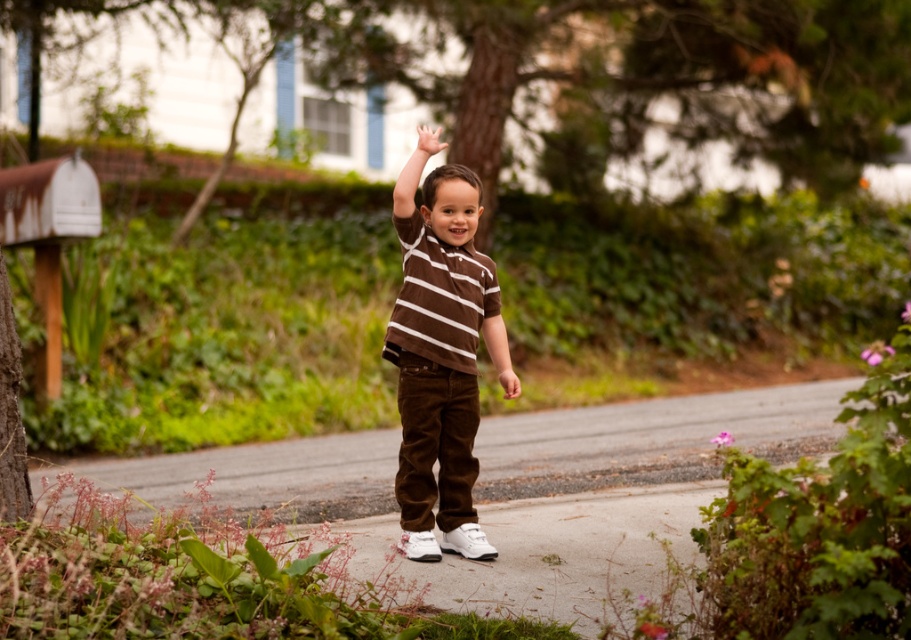
You are a drone operator trying to deliver a package to a point between the two points, point 1 at point (84, 465) and point 2 at point (509, 394). Which point is closer to the child standing on the path?

Point 1 at point (84, 465) is closer to the child standing on the path because it is further to the viewer than point 2 at point (509, 394).

You are a delivery person trying to place a package on the gray asphalt pavement at center near the wooden mailbox on the left. However, you notice the white matte hand at upper center is already on the pavement. Can the package fit next to the hand without overlapping it?

The gray asphalt pavement at center is larger in size than the white matte hand at upper center, so there is enough space to place the package next to the hand without overlapping.